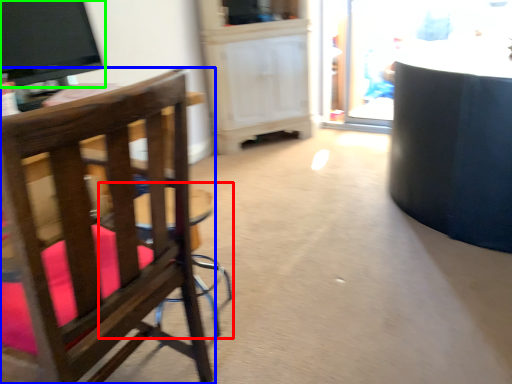
Question: Which object is positioned farthest from bar stool (highlighted by a red box)? Select from chair (highlighted by a blue box) and television (highlighted by a green box).

Choices:
 (A) chair
 (B) television

Answer: (B)